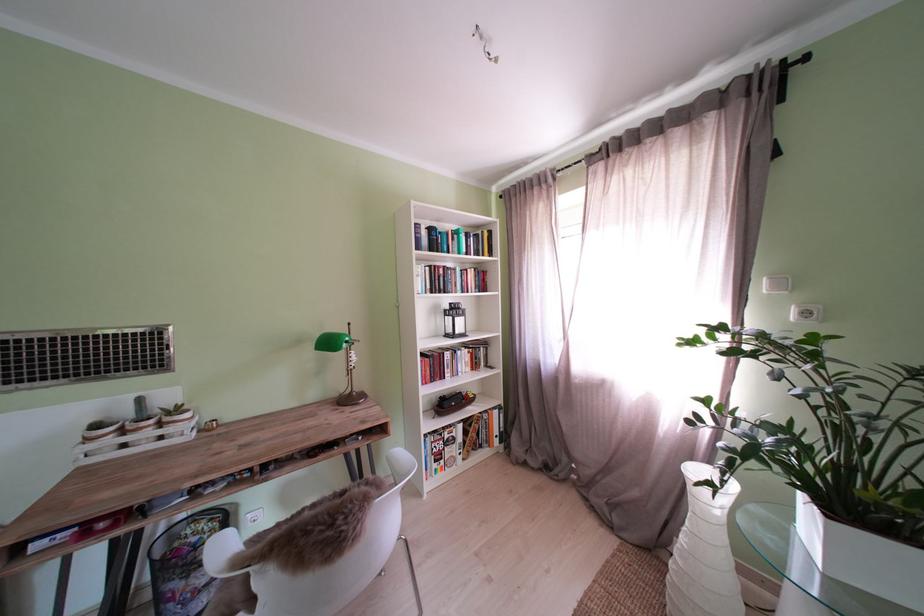
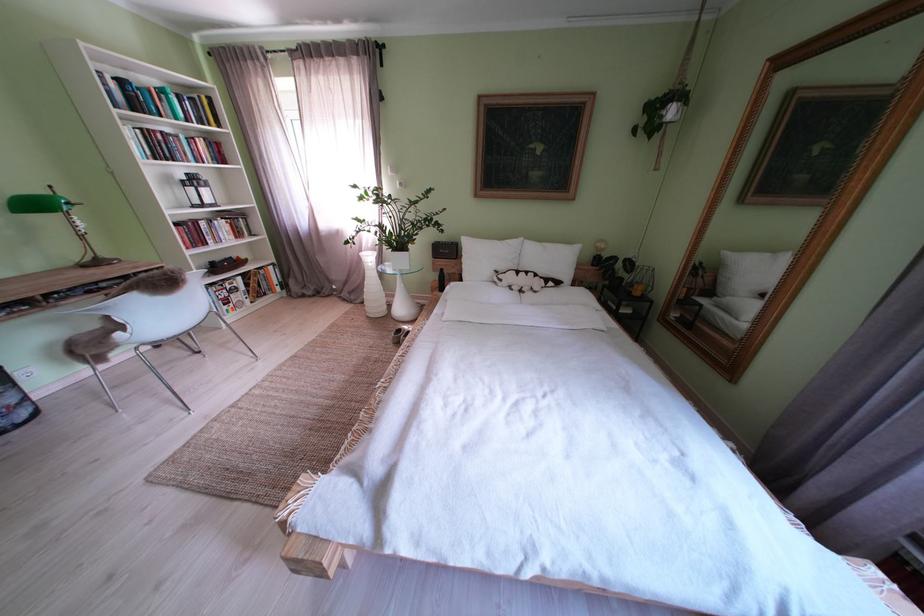
In the second image, find the point that corresponds to [626,525] in the first image.

(363, 302)